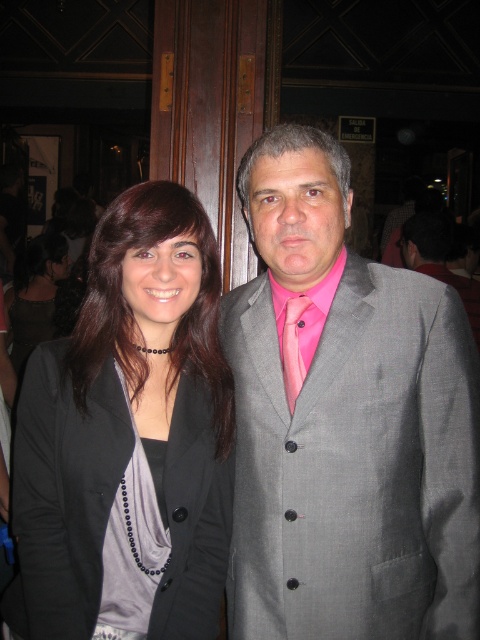
You are a photographer setting up for a group photo. You have a camera with a lens that can focus on objects within a 10 inch range. You need to ensure both the matte gray suit at center and the pink satin tie at center are in focus. Based on their positions, will both items be in focus?

The matte gray suit at center and pink satin tie at center are 10.18 inches apart from each other. Since the distance between them exceeds the camera lens focus range of 10 inches, both items may not be in focus simultaneously.

You are a photographer adjusting your camera settings to focus on the matte gray suit at center. The camera has a focus point at coordinates point (346, 422). Is this focus point correctly positioned to capture the matte gray suit at center?

Yes, the point (346, 422) corresponds to the matte gray suit at center, so the focus point is correctly positioned to capture the matte gray suit at center.